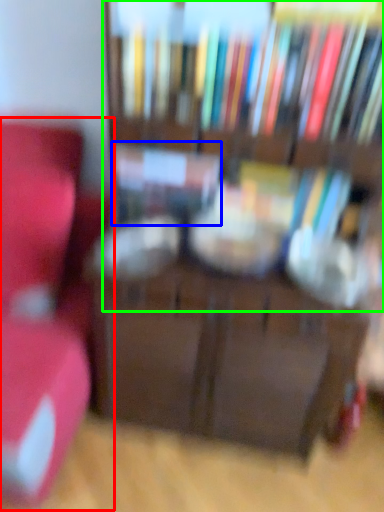
Question: Which is nearer to the furniture (highlighted by a red box)? book (highlighted by a blue box) or bookcase (highlighted by a green box).

Choices:
 (A) book
 (B) bookcase

Answer: (A)